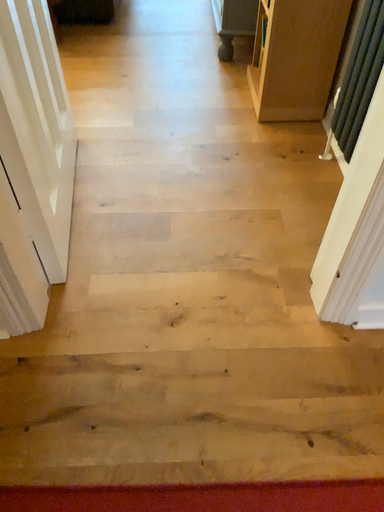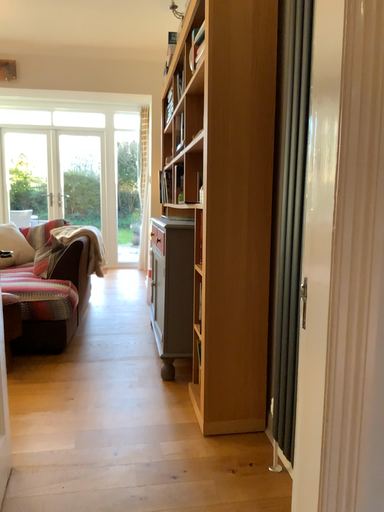
Question: How did the camera likely rotate when shooting the video?

Choices:
 (A) rotated upward
 (B) rotated downward

Answer: (A)